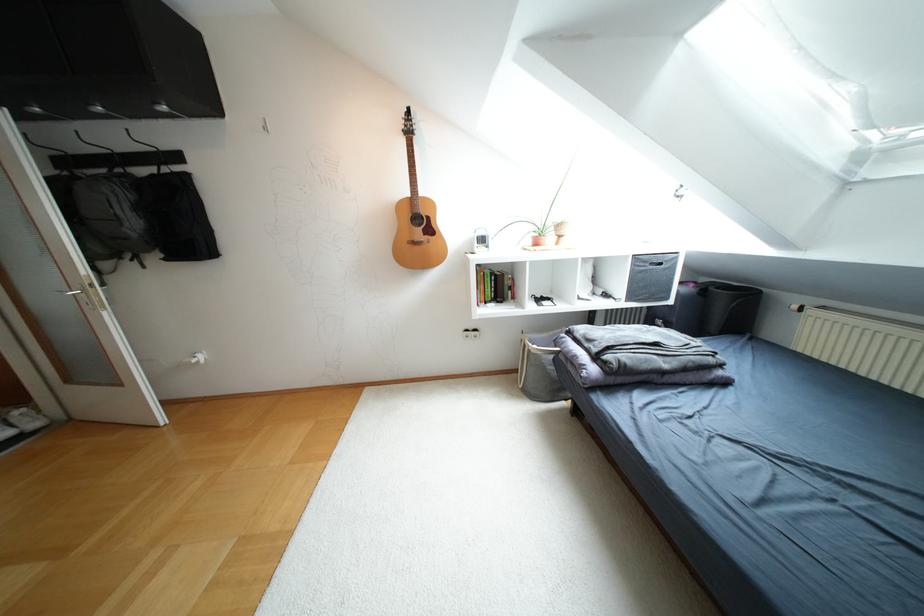
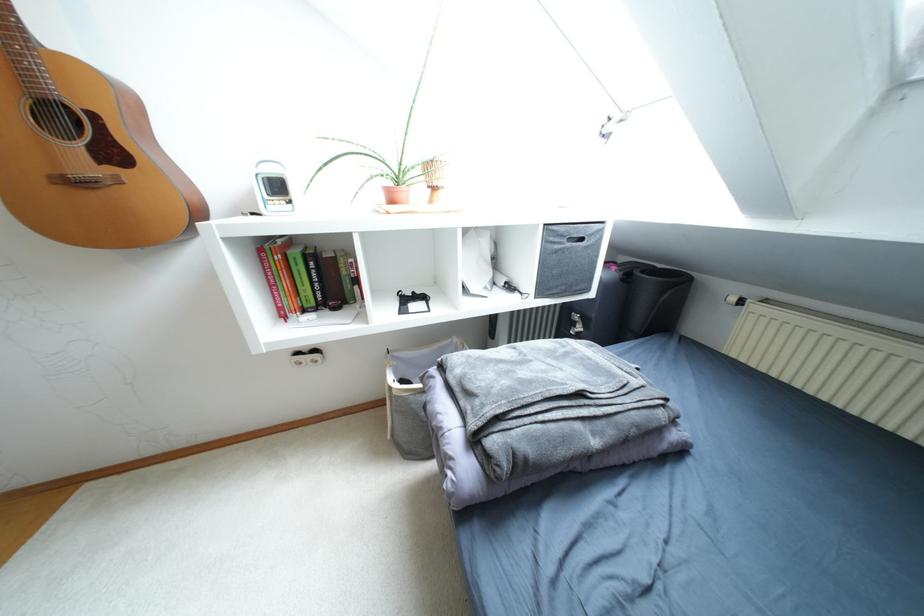
Question: The camera is either moving clockwise (left) or counter-clockwise (right) around the object. The first image is from the beginning of the video and the second image is from the end. Is the camera moving left or right when shooting the video?

Choices:
 (A) Left
 (B) Right

Answer: (A)